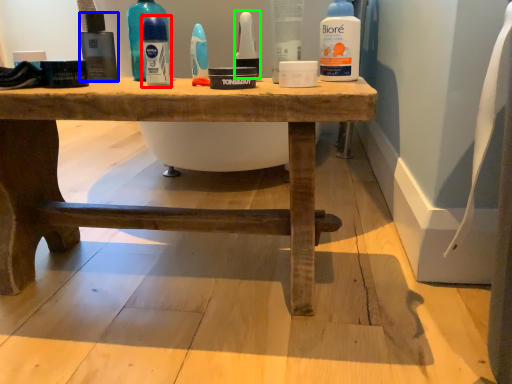
Question: Which object is positioned closest to mouthwash (highlighted by a red box)? Select from mouthwash (highlighted by a blue box) and mouthwash (highlighted by a green box).

Choices:
 (A) mouthwash
 (B) mouthwash

Answer: (A)